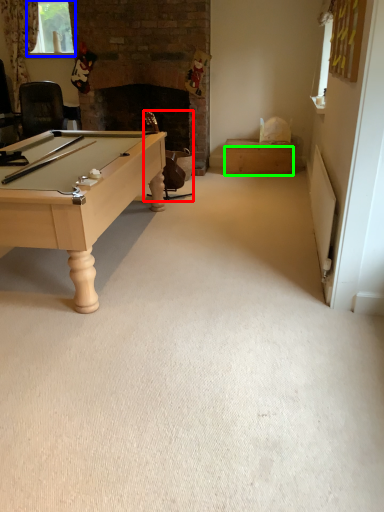
Question: Which object is the closest to the swivel chair (highlighted by a red box)? Choose among these: window screen (highlighted by a blue box) or drawer (highlighted by a green box).

Choices:
 (A) window screen
 (B) drawer

Answer: (B)